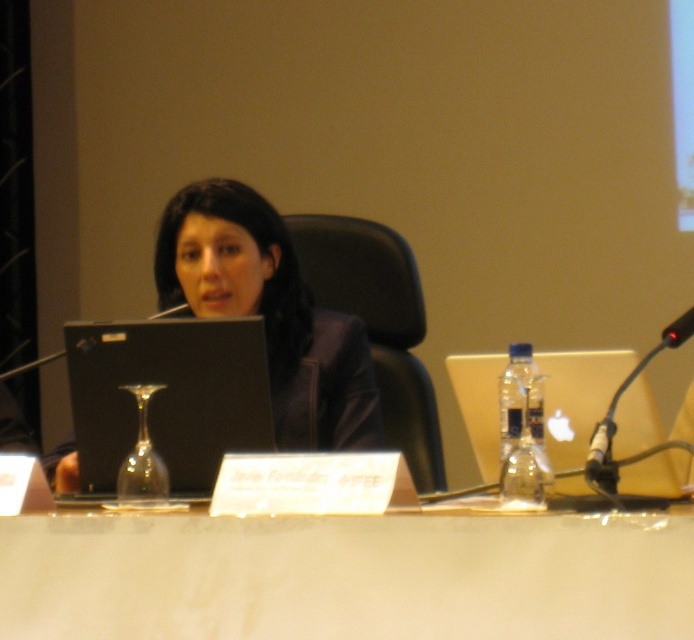
Can you confirm if white glossy table at center is taller than satin silver laptop at right?

No.

Does white glossy table at center have a lesser width compared to satin silver laptop at right?

No, white glossy table at center is not thinner than satin silver laptop at right.

Identify the location of white glossy table at center. (347, 577).

From the picture: Who is taller, matte black laptop at center or black plastic microphone at right?

With more height is matte black laptop at center.

Is matte black laptop at center above black plastic microphone at right?

Yes, matte black laptop at center is above black plastic microphone at right.

Who is more distant from viewer, (285, 372) or (661, 342)?

Point (285, 372)

Where is `matte black laptop at center`? matte black laptop at center is located at coordinates 269,312.

What do you see at coordinates (269, 312) in the screenshot? The height and width of the screenshot is (640, 694). I see `matte black laptop at center` at bounding box center [269, 312].

Can you confirm if matte black laptop at center is smaller than satin silver laptop at right?

Incorrect, matte black laptop at center is not smaller in size than satin silver laptop at right.

Is point (289, 259) closer to camera compared to point (493, 371)?

No, it is not.

Where is `matte black laptop at center`? matte black laptop at center is located at coordinates (269, 312).